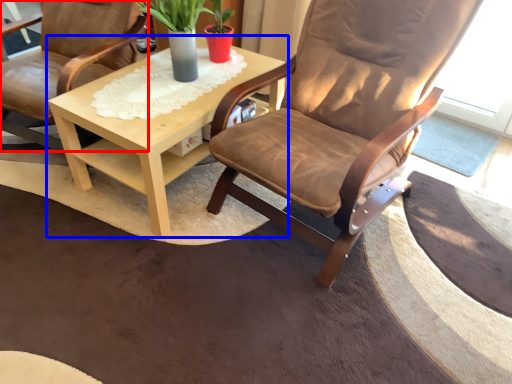
Question: Which point is further to the camera, chair (highlighted by a red box) or coffee table (highlighted by a blue box)?

Choices:
 (A) chair
 (B) coffee table

Answer: (B)